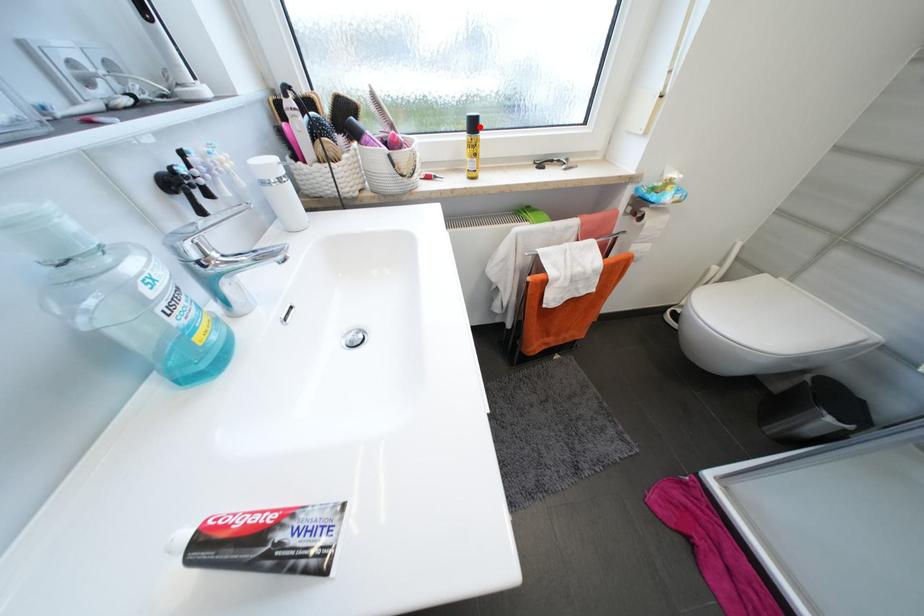
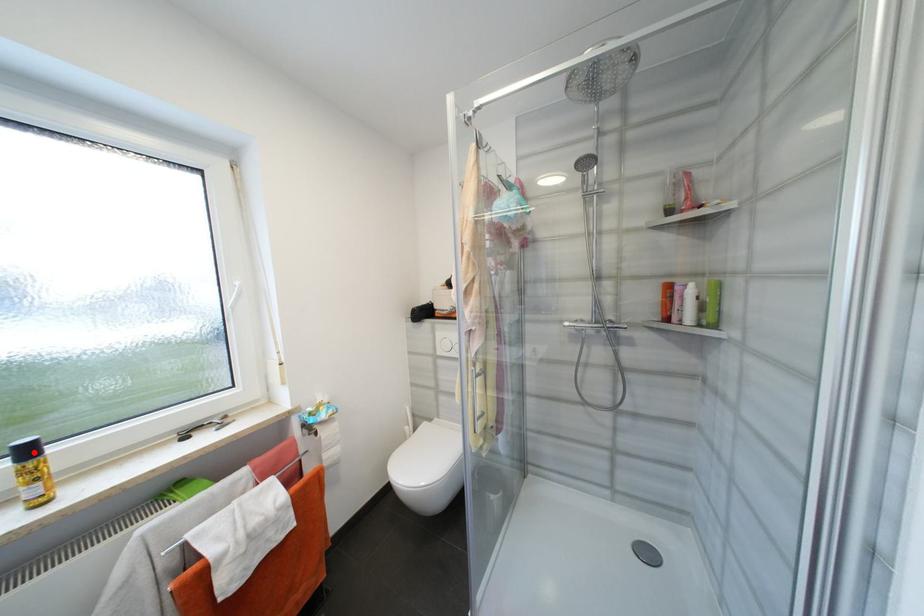
I am providing you with two images of the same scene from different viewpoints. A red point is marked on the first image and another point is marked on the second image. Are the points marked in image1 and image2 representing the same 3D position?

Yes